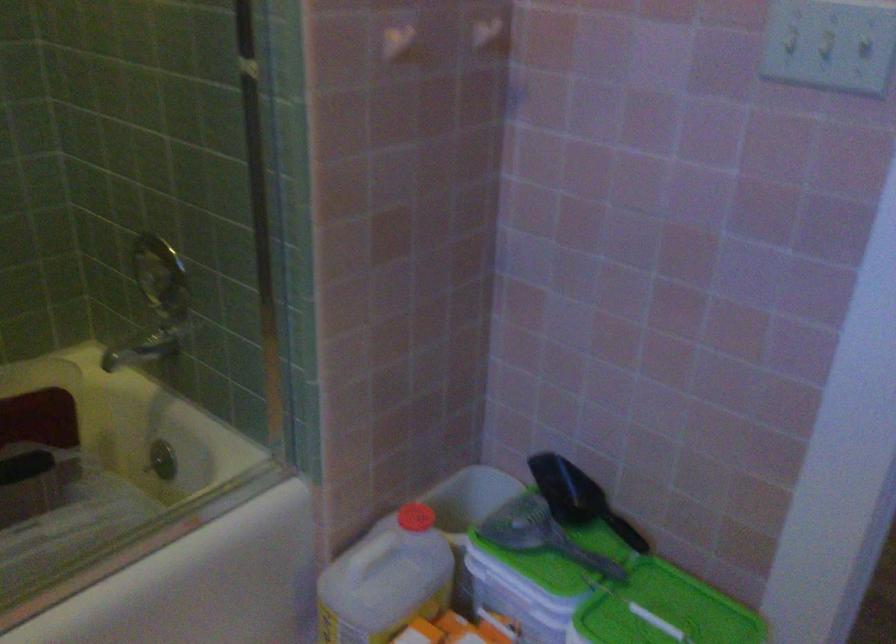
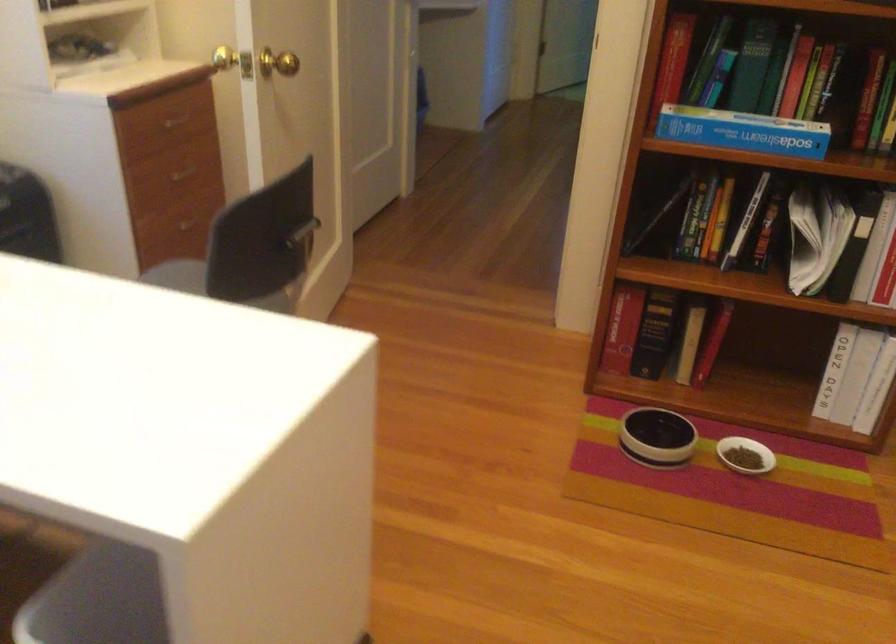
Question: I am providing you with two images of the same scene from different viewpoints. Which of the following objects are not visible in image2?

Choices:
 (A) metal cabinet hook
 (B) chair back handle
 (C) green lid handle
 (D) small white bowl

Answer: (C)